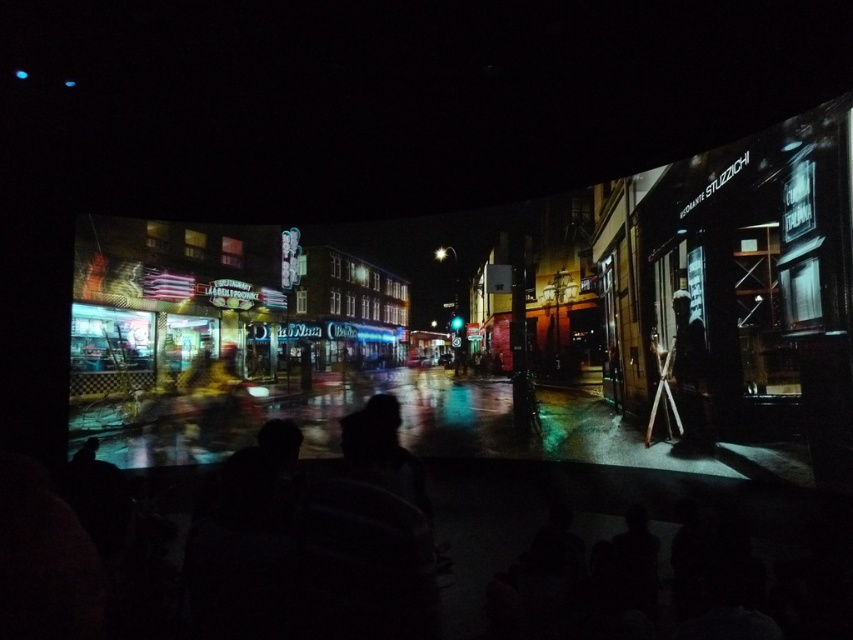
Question: Which point is closer to the camera?

Choices:
 (A) (675, 337)
 (B) (430, 509)

Answer: (B)

Question: Among these objects, which one is farthest from the camera?

Choices:
 (A) black matte crowd at center
 (B) dark textured figure at right

Answer: (B)

Question: Is black matte crowd at center smaller than dark textured figure at right?

Choices:
 (A) no
 (B) yes

Answer: (B)

Question: Is black matte crowd at center positioned before dark textured figure at right?

Choices:
 (A) yes
 (B) no

Answer: (A)

Question: Which point appears closest to the camera in this image?

Choices:
 (A) (697, 317)
 (B) (155, 545)

Answer: (B)

Question: Is black matte crowd at center wider than dark textured figure at right?

Choices:
 (A) yes
 (B) no

Answer: (B)